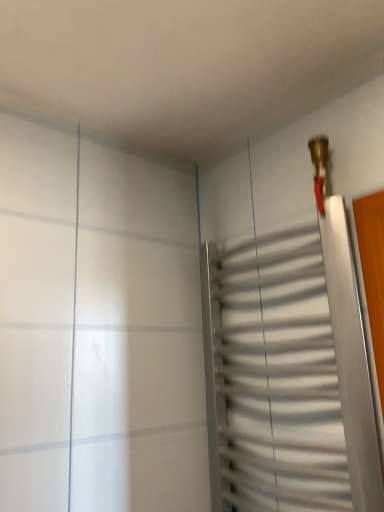
The image size is (384, 512). Describe the element at coordinates (289, 373) in the screenshot. I see `metallic silver radiator at upper center` at that location.

Where is `metallic silver radiator at upper center`? metallic silver radiator at upper center is located at coordinates (289, 373).

The width and height of the screenshot is (384, 512). I want to click on metallic silver radiator at upper center, so click(289, 373).